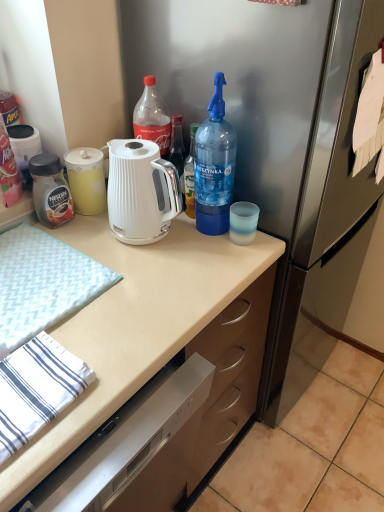
Where is `vacant space underneath white textured hand towel at left (from a real-world perspective)`? This screenshot has width=384, height=512. vacant space underneath white textured hand towel at left (from a real-world perspective) is located at coordinates (36, 278).